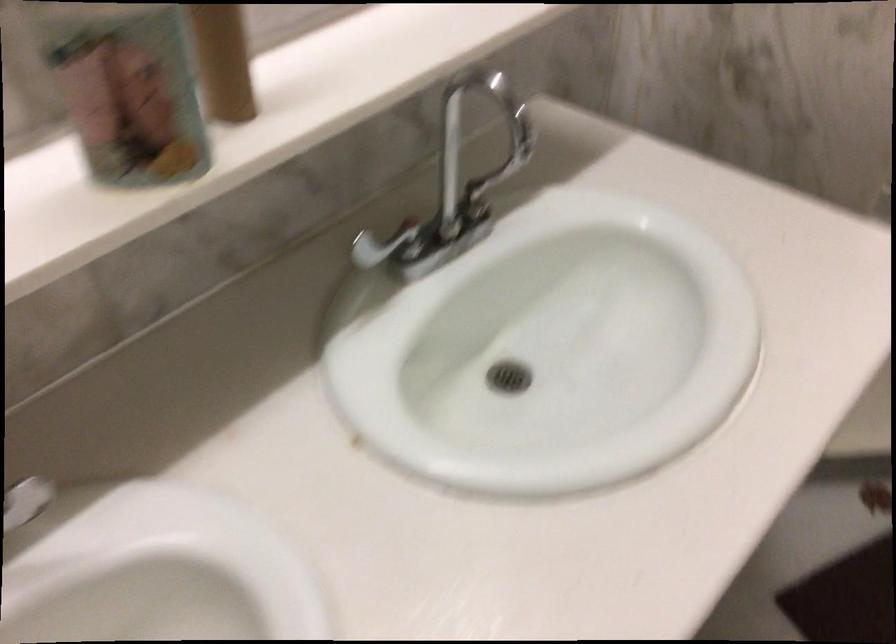
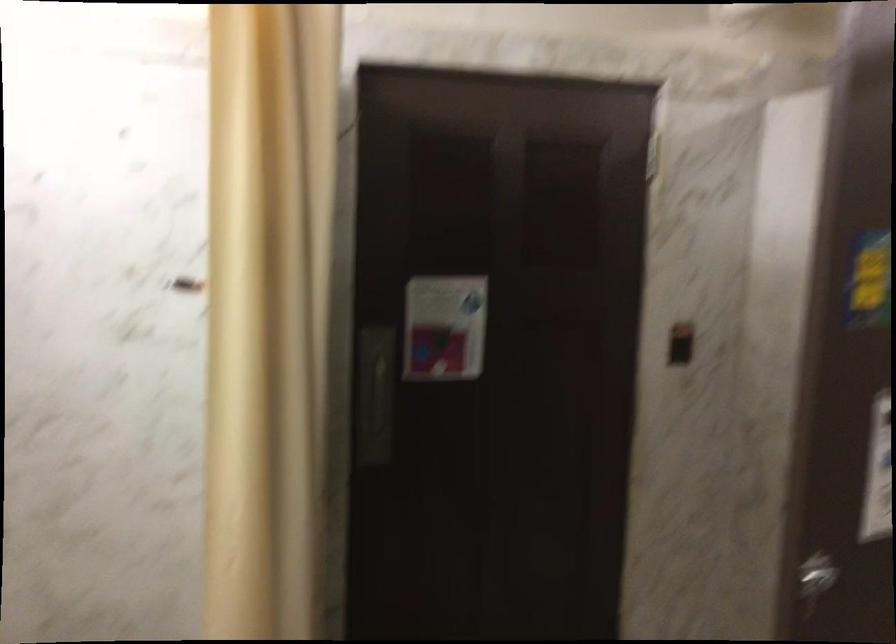
First-person continuous shooting, in which direction is the camera rotating?

The camera rotated toward right-up.